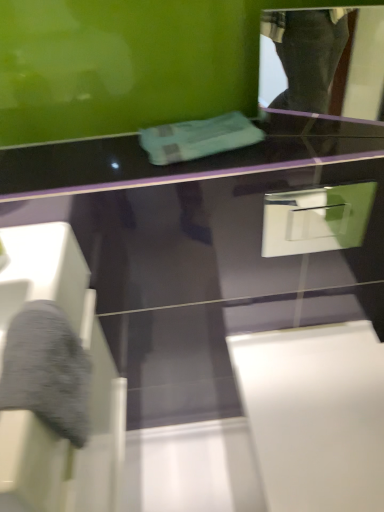
Question: Are teal fabric towel at center and glossy plastic mirror at upper right far apart?

Choices:
 (A) yes
 (B) no

Answer: (A)

Question: Does teal fabric towel at center come in front of glossy plastic mirror at upper right?

Choices:
 (A) yes
 (B) no

Answer: (B)

Question: From a real-world perspective, is teal fabric towel at center physically above glossy plastic mirror at upper right?

Choices:
 (A) yes
 (B) no

Answer: (B)

Question: Considering the relative sizes of teal fabric towel at center and glossy plastic mirror at upper right in the image provided, is teal fabric towel at center bigger than glossy plastic mirror at upper right?

Choices:
 (A) no
 (B) yes

Answer: (A)

Question: Considering the relative sizes of teal fabric towel at center and glossy plastic mirror at upper right in the image provided, is teal fabric towel at center taller than glossy plastic mirror at upper right?

Choices:
 (A) yes
 (B) no

Answer: (B)

Question: Does point (334, 245) appear closer or farther from the camera than point (274, 103)?

Choices:
 (A) closer
 (B) farther

Answer: (A)

Question: In the image, is white glossy drawer at upper right on the left side or the right side of glossy plastic mirror at upper right?

Choices:
 (A) right
 (B) left

Answer: (B)

Question: Considering the positions of white glossy drawer at upper right and glossy plastic mirror at upper right in the image, is white glossy drawer at upper right wider or thinner than glossy plastic mirror at upper right?

Choices:
 (A) thin
 (B) wide

Answer: (A)

Question: Is white glossy drawer at upper right taller or shorter than glossy plastic mirror at upper right?

Choices:
 (A) tall
 (B) short

Answer: (B)

Question: Does point (201, 121) appear closer or farther from the camera than point (347, 33)?

Choices:
 (A) closer
 (B) farther

Answer: (A)

Question: Is teal fabric towel at center wider or thinner than glossy plastic mirror at upper right?

Choices:
 (A) wide
 (B) thin

Answer: (A)

Question: Considering the positions of teal fabric towel at center and glossy plastic mirror at upper right in the image, is teal fabric towel at center taller or shorter than glossy plastic mirror at upper right?

Choices:
 (A) tall
 (B) short

Answer: (B)

Question: Considering the relative positions of teal fabric towel at center and glossy plastic mirror at upper right in the image provided, is teal fabric towel at center to the left or to the right of glossy plastic mirror at upper right?

Choices:
 (A) left
 (B) right

Answer: (A)

Question: In terms of width, does white glossy drawer at upper right look wider or thinner when compared to teal fabric towel at center?

Choices:
 (A) thin
 (B) wide

Answer: (A)

Question: Does point (374, 186) appear closer or farther from the camera than point (244, 117)?

Choices:
 (A) farther
 (B) closer

Answer: (A)